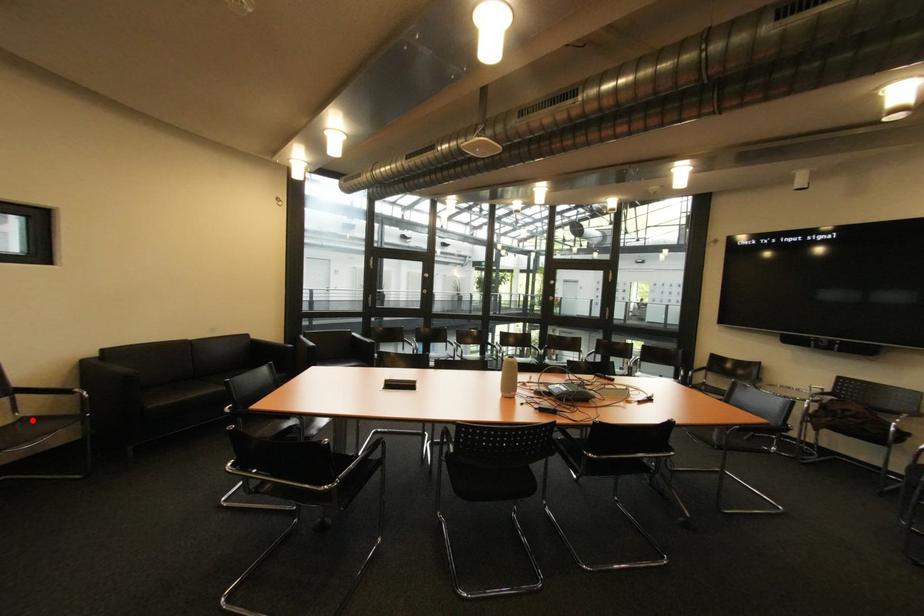
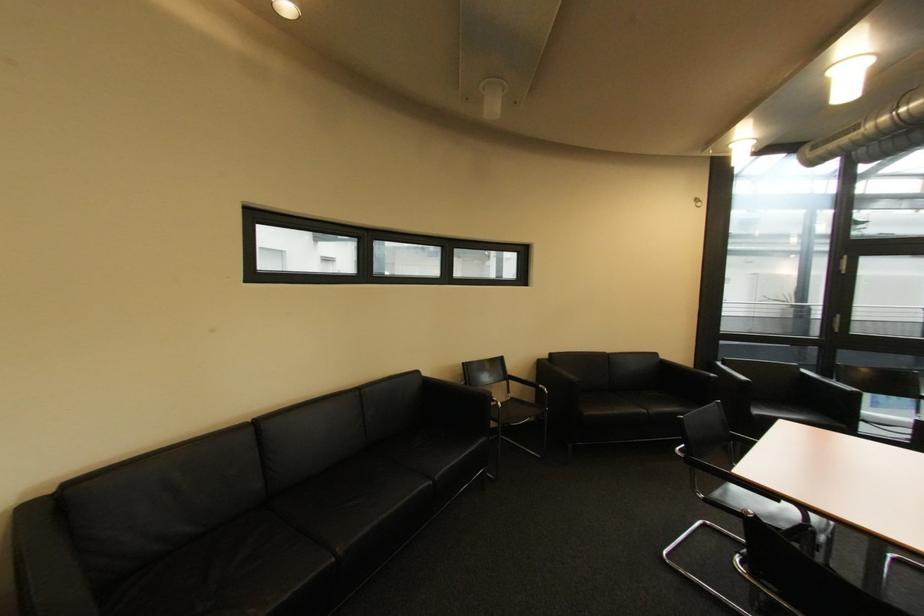
The point at the highlighted location is marked in the first image. Where is the corresponding point in the second image?

(520, 400)